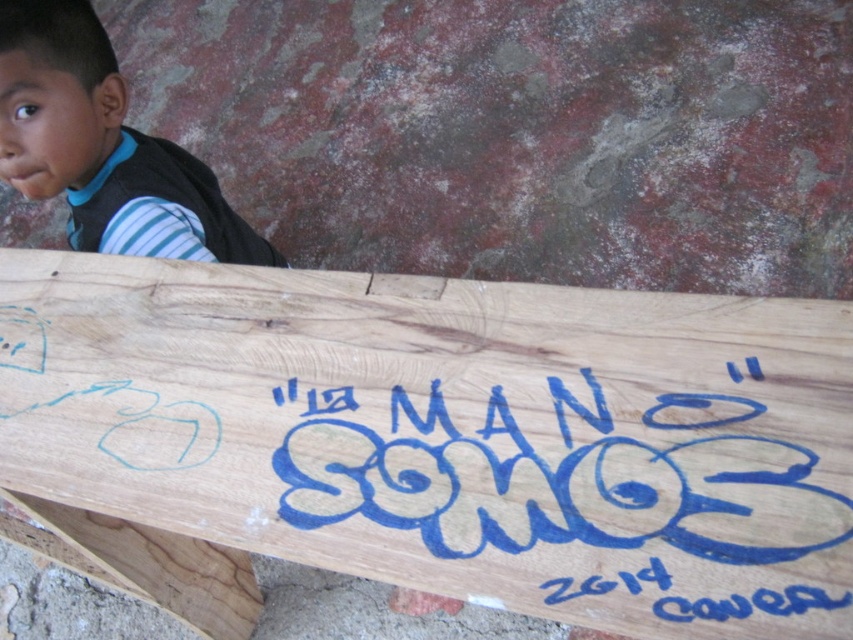
Between natural wood sign at lower center and blue painted graffiti at center, which one is positioned lower?

Positioned lower is natural wood sign at lower center.

Who is higher up, natural wood sign at lower center or blue painted graffiti at center?

blue painted graffiti at center is higher up.

Does point (450, 360) lie in front of point (831, 506)?

That is False.

I want to click on natural wood sign at lower center, so click(x=436, y=440).

Does blue painted graffiti at center have a lesser width compared to striped fabric shirt at upper left?

In fact, blue painted graffiti at center might be wider than striped fabric shirt at upper left.

Where is `blue painted graffiti at center`? blue painted graffiti at center is located at coordinates (575, 500).

Between point (381, 506) and point (88, 92), which one is positioned behind?

The point (88, 92) is behind.

At what (x,y) coordinates should I click in order to perform the action: click on blue painted graffiti at center. Please return your answer as a coordinate pair (x, y). This screenshot has width=853, height=640. Looking at the image, I should click on (575, 500).

Between point (456, 296) and point (178, 154), which one is positioned behind?

Point (178, 154)

Is natural wood sign at lower center taller than striped fabric shirt at upper left?

Yes, natural wood sign at lower center is taller than striped fabric shirt at upper left.

Where is `natural wood sign at lower center`? Image resolution: width=853 pixels, height=640 pixels. natural wood sign at lower center is located at coordinates (436, 440).

You are a GUI agent. You are given a task and a screenshot of the screen. Output one action in this format:
    pyautogui.click(x=<x>, y=<y>)
    Task: Click on the natural wood sign at lower center
    Image resolution: width=853 pixels, height=640 pixels.
    Given the screenshot: What is the action you would take?
    (436, 440)